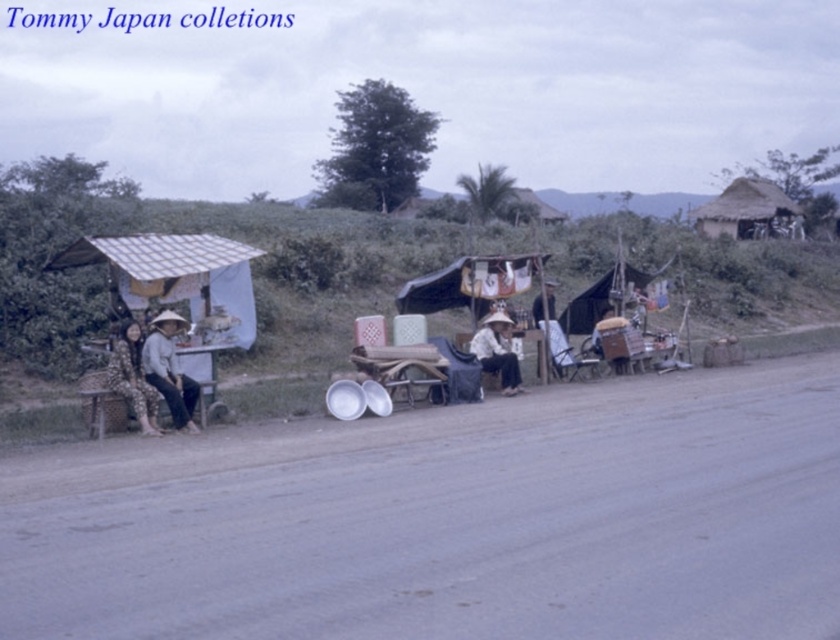
Question: Which object is positioned farthest from the matte white hat at left?

Choices:
 (A) black fabric canopy at center
 (B) matte white hat at center

Answer: (A)

Question: In this image, where is white fabric canopy at center located relative to matte white hat at center?

Choices:
 (A) right
 (B) left

Answer: (B)

Question: From the image, what is the correct spatial relationship of gray gravel road at lower center in relation to matte white hat at left?

Choices:
 (A) right
 (B) left

Answer: (A)

Question: Which point is closer to the camera taking this photo?

Choices:
 (A) (512, 593)
 (B) (743, 216)
 (C) (486, 268)

Answer: (A)

Question: Considering the real-world distances, which object is closest to the matte white hat at center?

Choices:
 (A) thatched straw hut at upper right
 (B) camouflage fabric pants at left

Answer: (B)

Question: Does thatched straw hut at upper right appear on the right side of camouflage fabric pants at left?

Choices:
 (A) yes
 (B) no

Answer: (A)